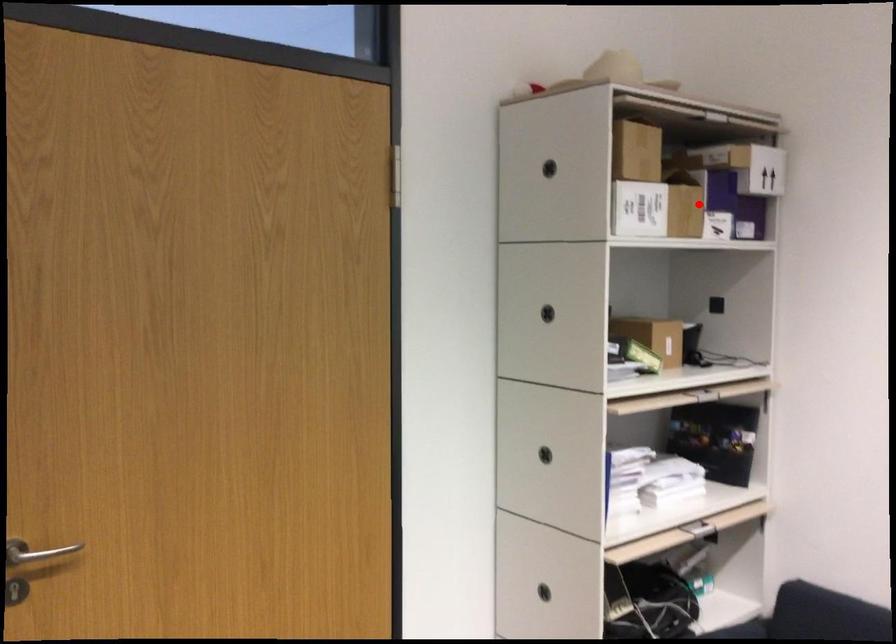
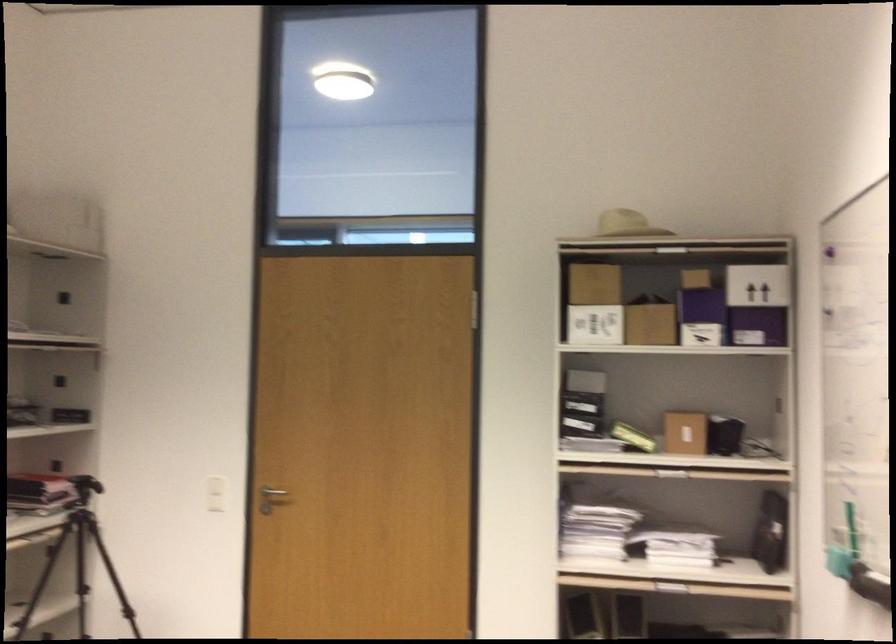
Find the pixel in the second image that matches the highlighted location in the first image.

(702, 317)